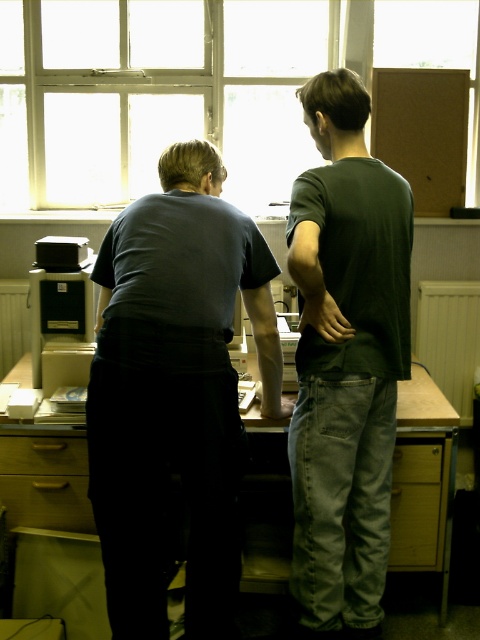
Question: Is dark green t-shirt at center closer to camera compared to wooden at lower left?

Choices:
 (A) yes
 (B) no

Answer: (A)

Question: Estimate the real-world distances between objects in this image. Which object is farther from the transparent glass window at upper center?

Choices:
 (A) dark gray shirt at center
 (B) wooden drawer at lower right
 (C) dark green t-shirt at center

Answer: (B)

Question: Is dark gray shirt at center smaller than wooden desk at center?

Choices:
 (A) yes
 (B) no

Answer: (B)

Question: Which point appears farthest from the camera in this image?

Choices:
 (A) (419, 464)
 (B) (349, 518)
 (C) (107, 161)
 (D) (51, 445)

Answer: (C)

Question: Which of the following is the closest to the observer?

Choices:
 (A) (273, 154)
 (B) (19, 529)
 (C) (391, 502)
 (D) (311, 403)

Answer: (D)

Question: Does transparent glass window at upper center appear on the right side of wooden desk at center?

Choices:
 (A) yes
 (B) no

Answer: (B)